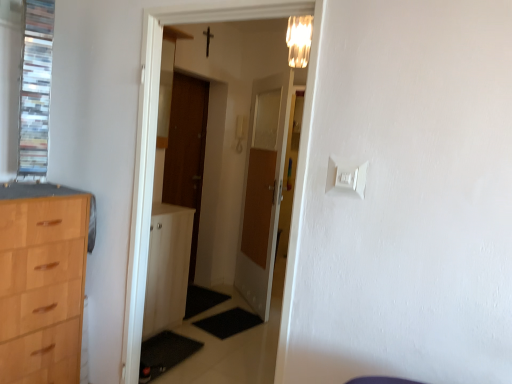
Question: Considering the relative positions of clear glass window at upper left and white plastic light switch at upper center in the image provided, is clear glass window at upper left behind white plastic light switch at upper center?

Choices:
 (A) yes
 (B) no

Answer: (A)

Question: Is clear glass window at upper left positioned with its back to white plastic light switch at upper center?

Choices:
 (A) yes
 (B) no

Answer: (B)

Question: Does clear glass window at upper left appear on the left side of white plastic light switch at upper center?

Choices:
 (A) yes
 (B) no

Answer: (A)

Question: Is clear glass window at upper left outside of white plastic light switch at upper center?

Choices:
 (A) yes
 (B) no

Answer: (A)

Question: Can you confirm if clear glass window at upper left is positioned to the right of white plastic light switch at upper center?

Choices:
 (A) no
 (B) yes

Answer: (A)

Question: Does clear glass window at upper left have a lesser height compared to white plastic light switch at upper center?

Choices:
 (A) no
 (B) yes

Answer: (A)

Question: Considering the relative sizes of white plastic light switch at upper center and wooden door at center, the first door from the left, in the image provided, is white plastic light switch at upper center bigger than wooden door at center, the first door from the left,?

Choices:
 (A) yes
 (B) no

Answer: (B)

Question: Does white plastic light switch at upper center appear on the left side of wooden door at center, the first door from the left?

Choices:
 (A) yes
 (B) no

Answer: (B)

Question: From the image's perspective, is white plastic light switch at upper center over wooden door at center, the first door from the left?

Choices:
 (A) no
 (B) yes

Answer: (A)

Question: Does white plastic light switch at upper center have a greater height compared to wooden door at center, the 2th door in the right-to-left sequence?

Choices:
 (A) no
 (B) yes

Answer: (A)

Question: Considering the relative sizes of white plastic light switch at upper center and wooden door at center, the first door from the left, in the image provided, is white plastic light switch at upper center shorter than wooden door at center, the first door from the left,?

Choices:
 (A) yes
 (B) no

Answer: (A)

Question: Can you confirm if white plastic light switch at upper center is positioned to the right of wooden door at center, the first door from the left?

Choices:
 (A) no
 (B) yes

Answer: (B)

Question: From the image's perspective, would you say wooden door at center, which is the first door from right to left, is shown under matte glass light fixture at upper center?

Choices:
 (A) no
 (B) yes

Answer: (B)